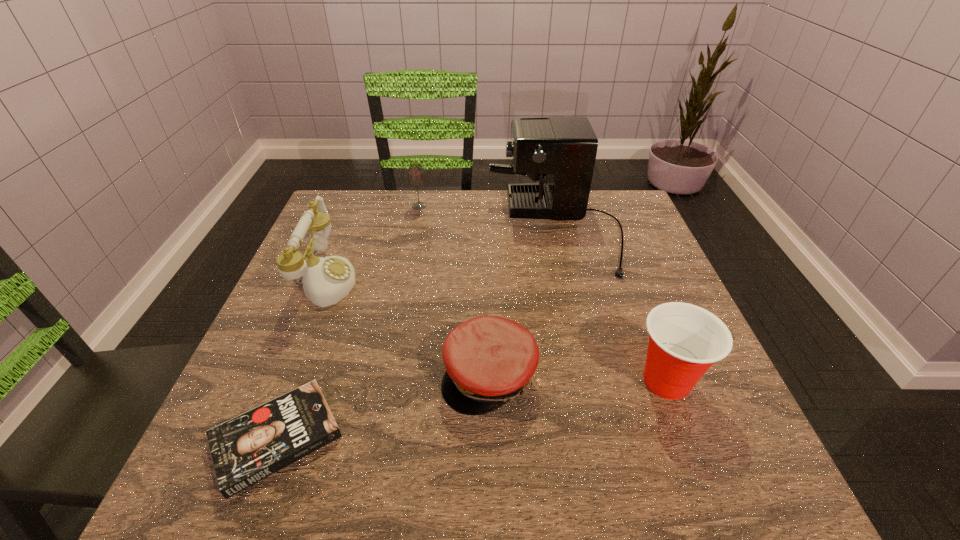
Locate an element on the screen. This screenshot has width=960, height=540. object that is positioned at the near left corner is located at coordinates (246, 449).

Image resolution: width=960 pixels, height=540 pixels. I want to click on object that is at the far right corner, so click(x=564, y=149).

The image size is (960, 540). I want to click on blank space at the far edge, so click(x=548, y=228).

In the image, there is a desktop. Where is `vacant area at the left edge`? This screenshot has height=540, width=960. vacant area at the left edge is located at coordinates (296, 361).

This screenshot has width=960, height=540. Find the location of `free space at the right edge of the desktop`. free space at the right edge of the desktop is located at coordinates (605, 287).

At what (x,y) coordinates should I click in order to perform the action: click on free space at the far left corner of the desktop. Please return your answer as a coordinate pair (x, y). The image size is (960, 540). Looking at the image, I should click on coord(339,228).

Where is `free space at the far right corner`? The image size is (960, 540). free space at the far right corner is located at coordinates click(x=611, y=222).

Locate an element on the screen. This screenshot has width=960, height=540. blank region between the tallest object and the cup is located at coordinates [x=611, y=305].

Image resolution: width=960 pixels, height=540 pixels. In order to click on empty space that is in between the shortest object and the second shortest object in this screenshot , I will do `click(383, 407)`.

This screenshot has width=960, height=540. I want to click on vacant area that lies between the cap and the fifth shortest object, so click(408, 328).